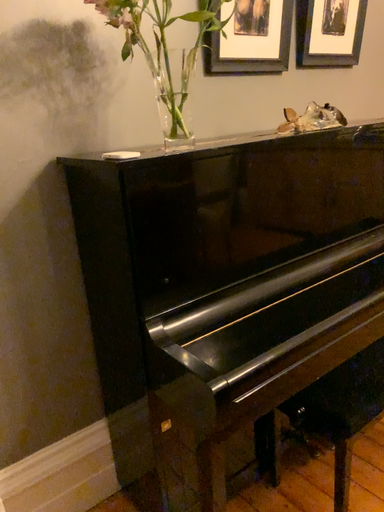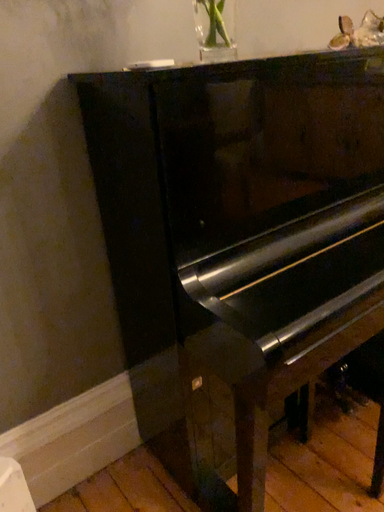
Question: How did the camera likely rotate when shooting the video?

Choices:
 (A) rotated upward
 (B) rotated downward

Answer: (B)